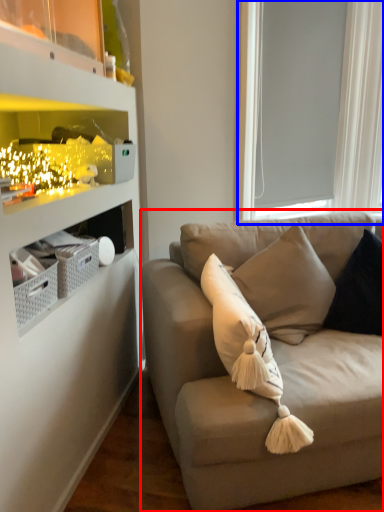
Question: Among these objects, which one is nearest to the camera, studio couch (highlighted by a red box) or window screen (highlighted by a blue box)?

Choices:
 (A) studio couch
 (B) window screen

Answer: (A)